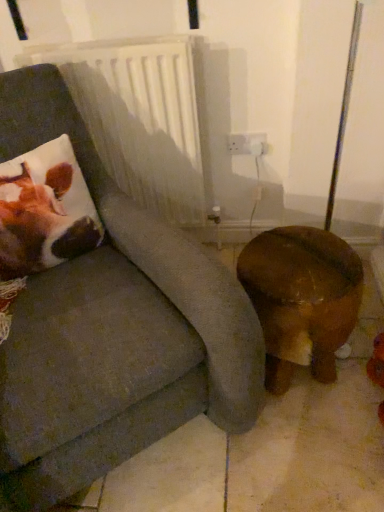
Locate an element on the screen. This screenshot has width=384, height=512. free location in front of brown wooden stool at lower right is located at coordinates (304, 450).